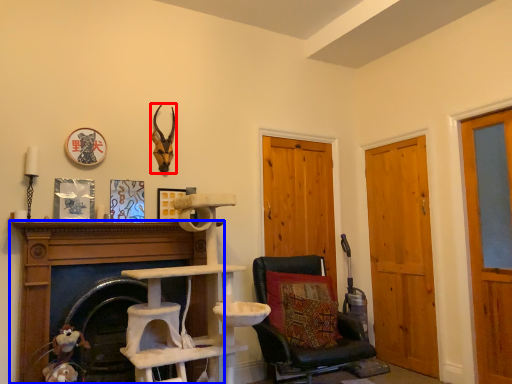
Question: Which of the following is the farthest to the observer, animal (highlighted by a red box) or fireplace (highlighted by a blue box)?

Choices:
 (A) animal
 (B) fireplace

Answer: (A)